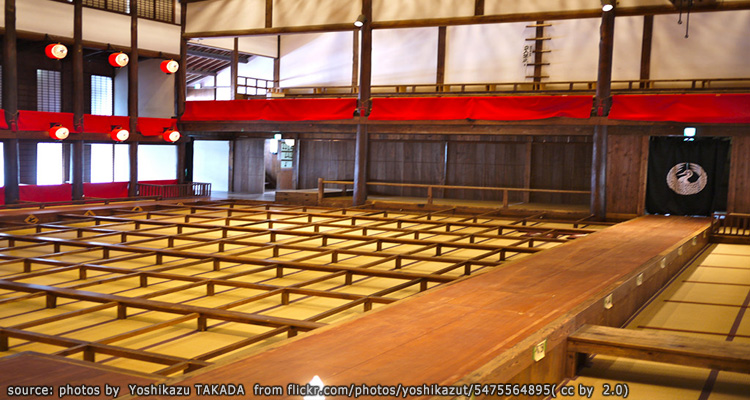
The image size is (750, 400). Identify the location of black curtain. (682, 148).